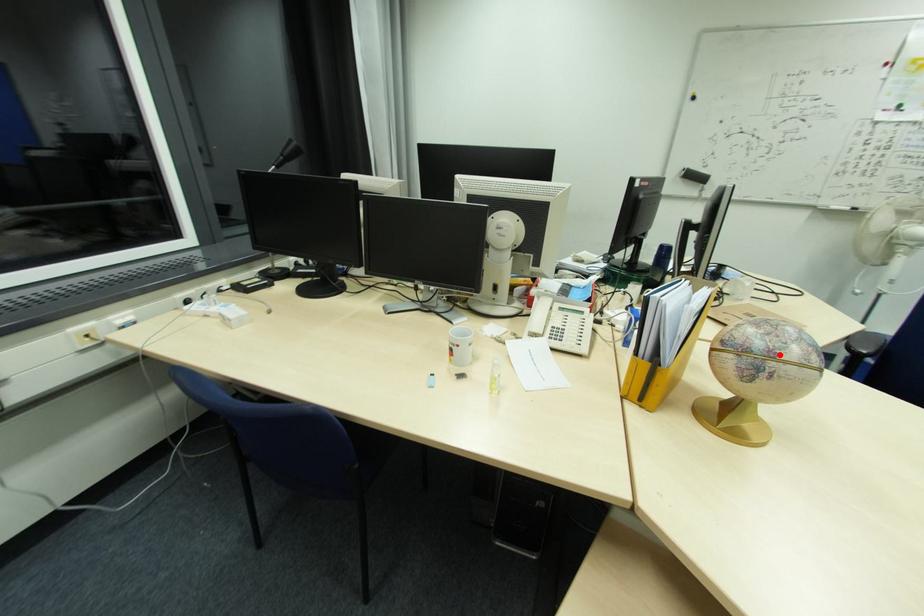
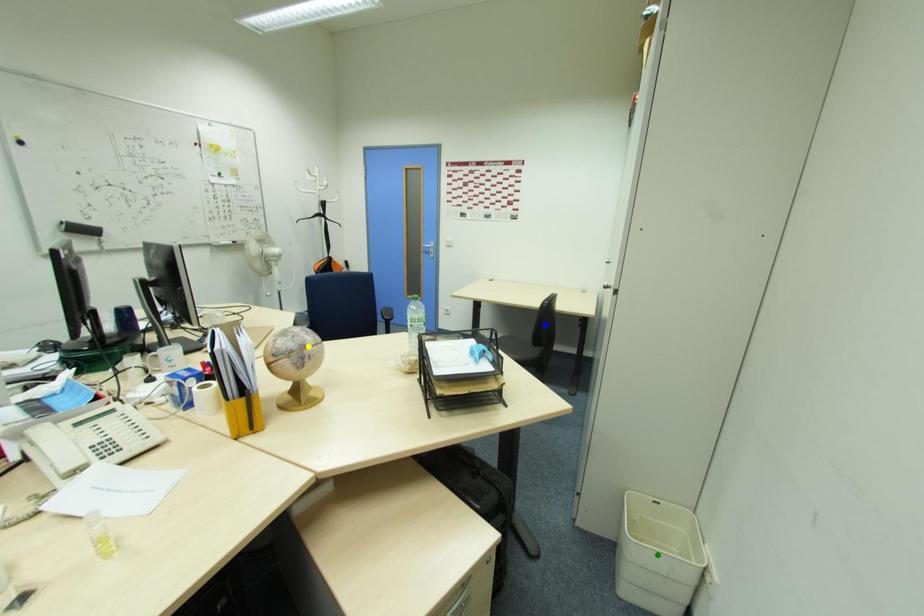
Question: I am providing you with two images of the same scene from different viewpoints. A red point is marked on the first image. You are given multiple points on the second image. Can you choose the point in image 2 that corresponds to the point in image 1?

Choices:
 (A) green point
 (B) blue point
 (C) yellow point

Answer: (C)